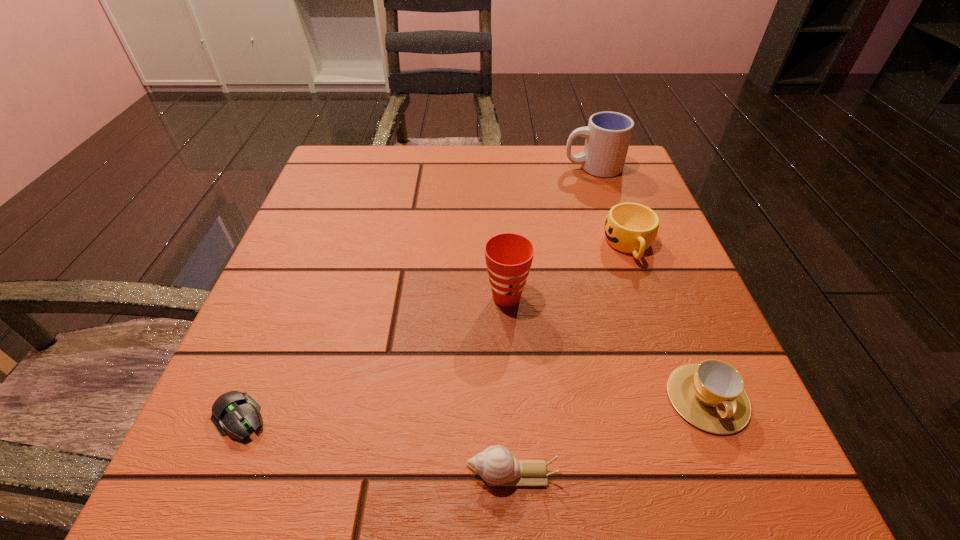
You are a GUI agent. You are given a task and a screenshot of the screen. Output one action in this format:
    pyautogui.click(x=<x>, y=<y>)
    Task: Click on the vacant area situated 0.250m with the handle on the side of the farthest object
    This screenshot has width=960, height=540.
    Given the screenshot: What is the action you would take?
    pyautogui.click(x=457, y=167)

Where is `vacant point located on the back of the second nearest cup`? Image resolution: width=960 pixels, height=540 pixels. vacant point located on the back of the second nearest cup is located at coordinates (501, 201).

The image size is (960, 540). I want to click on vacant area situated 0.160m on the front of the fifth nearest object, so click(663, 339).

The image size is (960, 540). What are the coordinates of `vacant point located 0.080m with the handle on the side of the nearest cup` in the screenshot? It's located at (749, 501).

Where is `vacant area situated 0.300m on the shell of the nearest object`? This screenshot has width=960, height=540. vacant area situated 0.300m on the shell of the nearest object is located at coordinates (222, 474).

Locate an element on the screen. vacant space located 0.080m on the shell of the nearest object is located at coordinates (401, 474).

Find the location of a particular element. The width and height of the screenshot is (960, 540). free space located on the shell of the nearest object is located at coordinates [369, 474].

Where is `vacant area located 0.390m on the back of the computer mouse`? vacant area located 0.390m on the back of the computer mouse is located at coordinates (321, 221).

Identify the location of object present at the far edge. The height and width of the screenshot is (540, 960). (608, 134).

Where is `escargot present at the near edge`? The width and height of the screenshot is (960, 540). escargot present at the near edge is located at coordinates (495, 465).